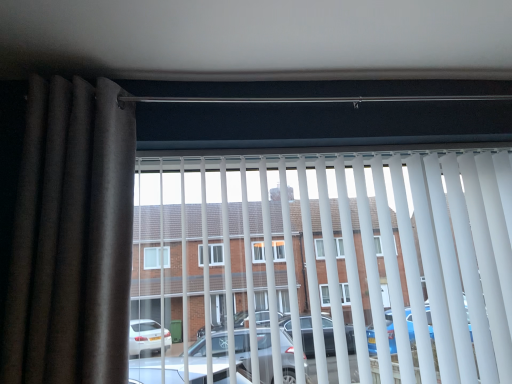
Question: Is white plastic blinds at center surrounded by brown fabric curtain at left?

Choices:
 (A) no
 (B) yes

Answer: (A)

Question: Considering the relative sizes of brown fabric curtain at left and white plastic blinds at center in the image provided, is brown fabric curtain at left shorter than white plastic blinds at center?

Choices:
 (A) yes
 (B) no

Answer: (B)

Question: Is brown fabric curtain at left smaller than white plastic blinds at center?

Choices:
 (A) yes
 (B) no

Answer: (A)

Question: From the image's perspective, is brown fabric curtain at left beneath white plastic blinds at center?

Choices:
 (A) yes
 (B) no

Answer: (B)

Question: Is brown fabric curtain at left at the left side of white plastic blinds at center?

Choices:
 (A) yes
 (B) no

Answer: (A)

Question: Is the position of brown fabric curtain at left more distant than that of white plastic blinds at center?

Choices:
 (A) yes
 (B) no

Answer: (B)

Question: Does white plastic blinds at center turn towards brown fabric curtain at left?

Choices:
 (A) yes
 (B) no

Answer: (B)

Question: Is white plastic blinds at center with brown fabric curtain at left?

Choices:
 (A) yes
 (B) no

Answer: (B)

Question: Is white plastic blinds at center not close to brown fabric curtain at left?

Choices:
 (A) no
 (B) yes

Answer: (A)

Question: Is white plastic blinds at center taller than brown fabric curtain at left?

Choices:
 (A) no
 (B) yes

Answer: (A)

Question: Is white plastic blinds at center turned away from brown fabric curtain at left?

Choices:
 (A) yes
 (B) no

Answer: (B)

Question: Is white plastic blinds at center outside of brown fabric curtain at left?

Choices:
 (A) no
 (B) yes

Answer: (B)

Question: From a real-world perspective, is white plastic blinds at center physically located above or below brown fabric curtain at left?

Choices:
 (A) below
 (B) above

Answer: (A)